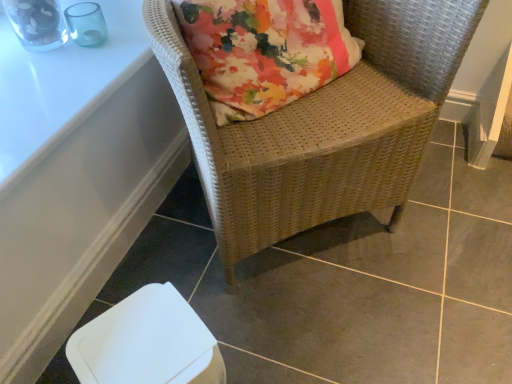
At what (x,y) coordinates should I click in order to perform the action: click on free area in between woven wicker chair at upper right and white plastic swivel chair at lower left. Please return your answer as a coordinate pair (x, y). The height and width of the screenshot is (384, 512). Looking at the image, I should click on (258, 296).